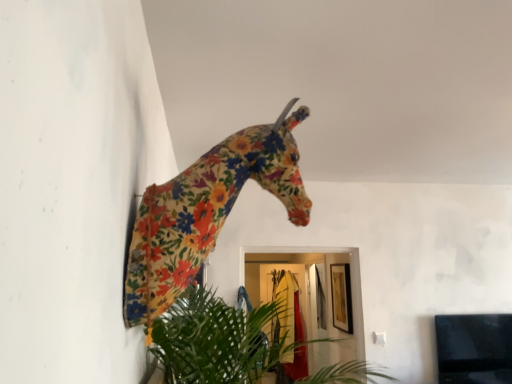
What do you see at coordinates (217, 340) in the screenshot? I see `green leafy plant at lower center` at bounding box center [217, 340].

Measure the distance between point (263,338) and camera.

Point (263,338) and camera are 4.73 feet apart.

This screenshot has width=512, height=384. Find the location of `green leafy plant at lower center`. green leafy plant at lower center is located at coordinates (217, 340).

Locate an element on the screen. The height and width of the screenshot is (384, 512). floral fabric giraffe at upper center is located at coordinates (206, 211).

What do you see at coordinates (206, 211) in the screenshot? The width and height of the screenshot is (512, 384). I see `floral fabric giraffe at upper center` at bounding box center [206, 211].

You are a GUI agent. You are given a task and a screenshot of the screen. Output one action in this format:
    pyautogui.click(x=<x>, y=<y>)
    Task: Click on the green leafy plant at lower center
    This screenshot has width=512, height=384.
    Given the screenshot: What is the action you would take?
    pyautogui.click(x=217, y=340)

Between floral fabric giraffe at upper center and green leafy plant at lower center, which one appears on the right side from the viewer's perspective?

Positioned to the right is green leafy plant at lower center.

Consider the image. Does floral fabric giraffe at upper center lie in front of green leafy plant at lower center?

Yes, floral fabric giraffe at upper center is in front of green leafy plant at lower center.

Considering the points (140, 286) and (196, 303), which point is behind, point (140, 286) or point (196, 303)?

The point (196, 303) is more distant.

From the image's perspective, which is below, floral fabric giraffe at upper center or green leafy plant at lower center?

green leafy plant at lower center.

From a real-world perspective, is floral fabric giraffe at upper center located higher than green leafy plant at lower center?

Yes, from a real-world perspective, floral fabric giraffe at upper center is over green leafy plant at lower center

Which of these two, floral fabric giraffe at upper center or green leafy plant at lower center, is thinner?

floral fabric giraffe at upper center.

Considering the relative sizes of floral fabric giraffe at upper center and green leafy plant at lower center in the image provided, is floral fabric giraffe at upper center taller than green leafy plant at lower center?

Yes.

Considering the sizes of objects floral fabric giraffe at upper center and green leafy plant at lower center in the image provided, who is smaller, floral fabric giraffe at upper center or green leafy plant at lower center?

With smaller size is floral fabric giraffe at upper center.

Is floral fabric giraffe at upper center inside or outside of green leafy plant at lower center?

floral fabric giraffe at upper center is spatially situated outside green leafy plant at lower center.

Is floral fabric giraffe at upper center positioned far away from green leafy plant at lower center?

That's not correct — floral fabric giraffe at upper center is a little close to green leafy plant at lower center.

Is floral fabric giraffe at upper center positioned with its back to green leafy plant at lower center?

No, floral fabric giraffe at upper center is not facing the opposite direction of green leafy plant at lower center.

In the image, there is a green leafy plant at lower center. Identify the location of giraffe above it (from the image's perspective). (206, 211).

Is green leafy plant at lower center at the right side of floral fabric giraffe at upper center?

Yes.

Is the position of green leafy plant at lower center less distant than that of floral fabric giraffe at upper center?

No, green leafy plant at lower center is further to the viewer.

Considering the points (242, 311) and (158, 186), which point is behind, point (242, 311) or point (158, 186)?

The point (242, 311) is behind.

From the image's perspective, would you say green leafy plant at lower center is shown under floral fabric giraffe at upper center?

Yes, from the image's perspective, green leafy plant at lower center is beneath floral fabric giraffe at upper center.

From a real-world perspective, is green leafy plant at lower center physically above floral fabric giraffe at upper center?

No, from a real-world perspective, green leafy plant at lower center is not on top of floral fabric giraffe at upper center.

Considering the sizes of green leafy plant at lower center and floral fabric giraffe at upper center in the image, is green leafy plant at lower center wider or thinner than floral fabric giraffe at upper center?

Clearly, green leafy plant at lower center has more width compared to floral fabric giraffe at upper center.

Considering the sizes of green leafy plant at lower center and floral fabric giraffe at upper center in the image, is green leafy plant at lower center taller or shorter than floral fabric giraffe at upper center?

In the image, green leafy plant at lower center appears to be shorter than floral fabric giraffe at upper center.

Between green leafy plant at lower center and floral fabric giraffe at upper center, which one has larger size?

Bigger between the two is green leafy plant at lower center.

Is green leafy plant at lower center located outside floral fabric giraffe at upper center?

green leafy plant at lower center lies outside floral fabric giraffe at upper center's area.

Is green leafy plant at lower center not close to floral fabric giraffe at upper center?

That's not correct — green leafy plant at lower center is a little close to floral fabric giraffe at upper center.

Is green leafy plant at lower center facing away from floral fabric giraffe at upper center?

green leafy plant at lower center does not have its back to floral fabric giraffe at upper center.

Where is `giraffe above the green leafy plant at lower center (from the image's perspective)`? The height and width of the screenshot is (384, 512). giraffe above the green leafy plant at lower center (from the image's perspective) is located at coordinates (206, 211).

Where is `houseplant that is behind the floral fabric giraffe at upper center`? The width and height of the screenshot is (512, 384). houseplant that is behind the floral fabric giraffe at upper center is located at coordinates (217, 340).

At what (x,y) coordinates should I click in order to perform the action: click on houseplant that is on the right side of floral fabric giraffe at upper center. Please return your answer as a coordinate pair (x, y). The height and width of the screenshot is (384, 512). Looking at the image, I should click on (217, 340).